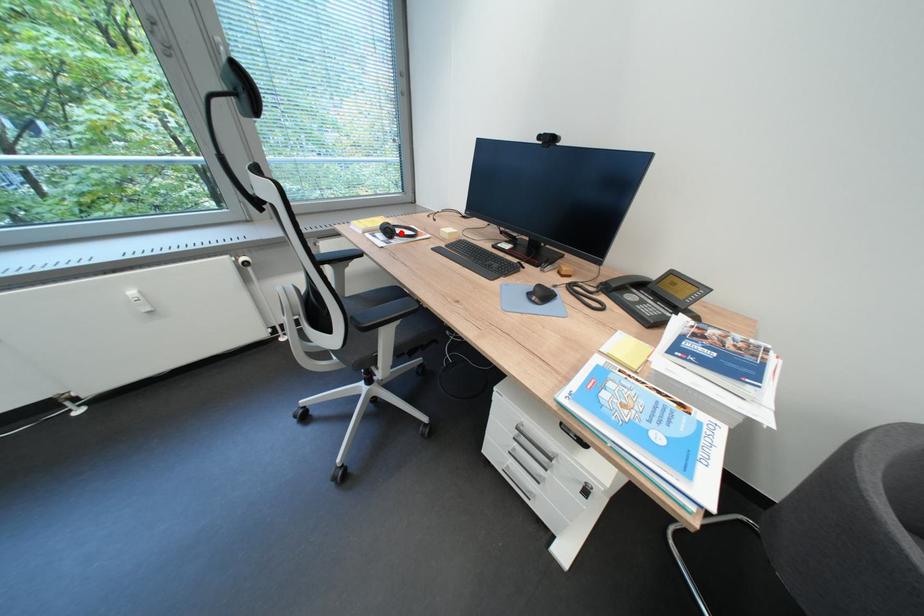
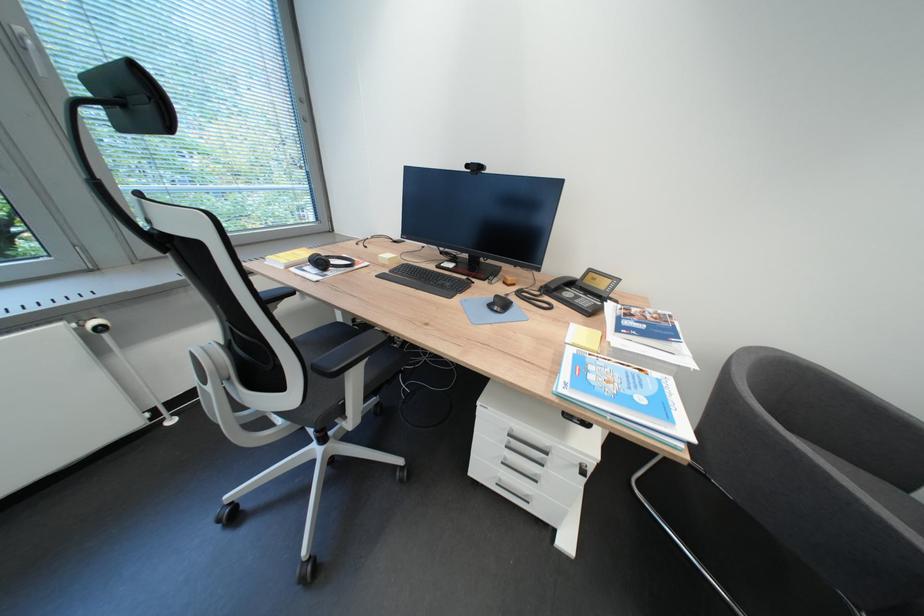
Question: I am providing you with two images of the same scene from different viewpoints. A red point is marked on the first image. Is the red point's position out of view in image 2?

Choices:
 (A) Yes
 (B) No

Answer: (B)